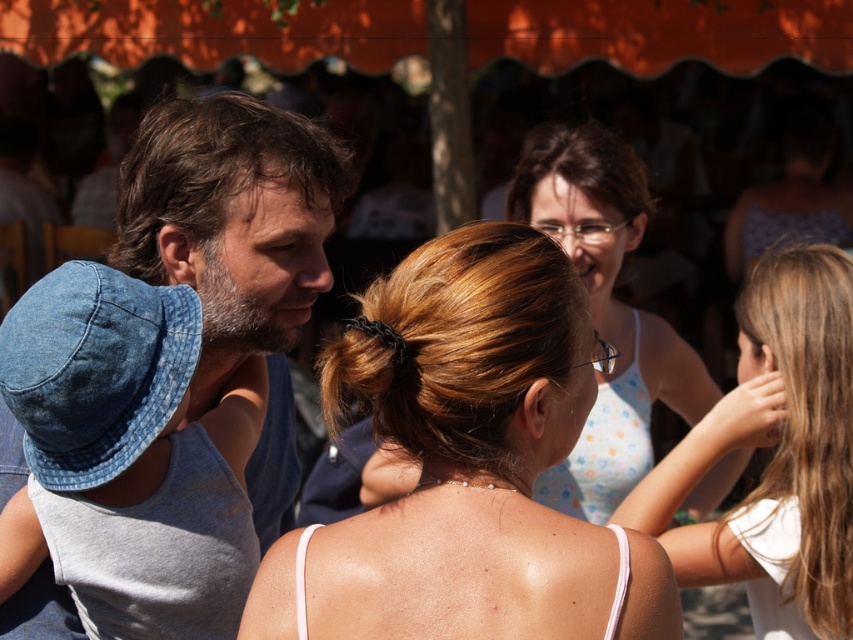
Does white cotton tank top at upper right lie in front of brown matte hair at upper center?

Yes, white cotton tank top at upper right is closer to the viewer.

Locate an element on the screen. white cotton tank top at upper right is located at coordinates (775, 454).

What do you see at coordinates (775, 454) in the screenshot?
I see `white cotton tank top at upper right` at bounding box center [775, 454].

Where is `white cotton tank top at upper right`? Image resolution: width=853 pixels, height=640 pixels. white cotton tank top at upper right is located at coordinates (775, 454).

Is point (468, 244) closer to viewer compared to point (596, 403)?

Yes, point (468, 244) is in front of point (596, 403).

Between point (410, 300) and point (598, 433), which one is positioned behind?

The point (598, 433) is more distant.

Which is in front, point (587, 324) or point (543, 490)?

Point (587, 324) is in front.

Locate an element on the screen. The height and width of the screenshot is (640, 853). brownhairbandhair at center is located at coordinates (459, 342).

Which is more to the left, white cotton tank top at upper right or brownwoollyhair at center?

Positioned to the left is brownwoollyhair at center.

Between white cotton tank top at upper right and brownwoollyhair at center, which one has less height?

With less height is brownwoollyhair at center.

Is point (825, 291) closer to viewer compared to point (202, 160)?

That is False.

The image size is (853, 640). I want to click on white cotton tank top at upper right, so click(x=775, y=454).